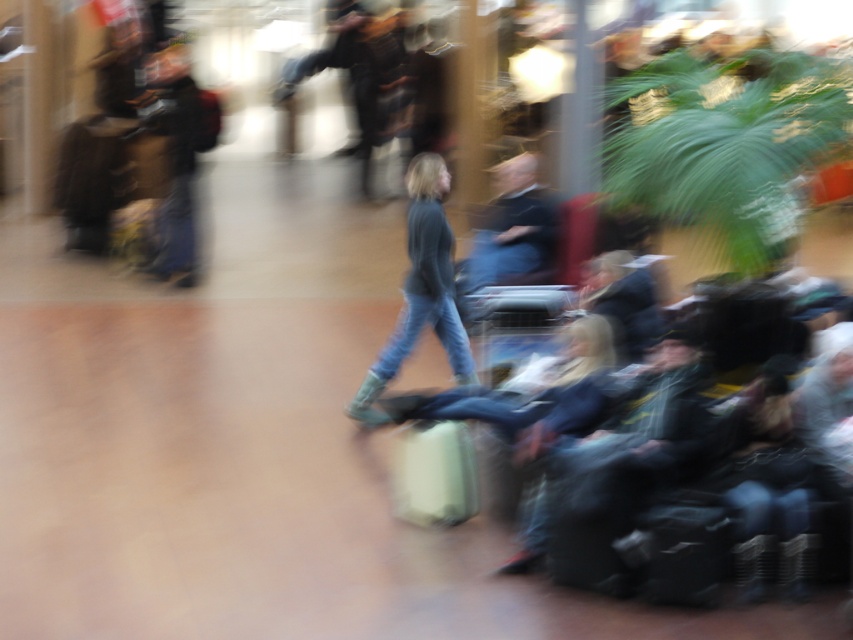
Can you confirm if denim jeans at center is positioned above dark blue sweater at center?

Actually, denim jeans at center is below dark blue sweater at center.

Does point (463, 326) lie in front of point (540, 198)?

Yes.

You are a GUI agent. You are given a task and a screenshot of the screen. Output one action in this format:
    pyautogui.click(x=<x>, y=<y>)
    Task: Click on the denim jeans at center
    The image size is (853, 640).
    Given the screenshot: What is the action you would take?
    pyautogui.click(x=421, y=291)

Does denim jeans at center have a larger size compared to black matte suitcase at lower right?

Yes.

Which is more to the right, denim jeans at center or black matte suitcase at lower right?

black matte suitcase at lower right

This screenshot has height=640, width=853. I want to click on denim jeans at center, so click(x=421, y=291).

Find the location of a particular element. The height and width of the screenshot is (640, 853). denim jeans at center is located at coordinates (421, 291).

Between denim jeans at center and beige fabric suitcase at center, which one is positioned higher?

denim jeans at center is above.

Does denim jeans at center appear under beige fabric suitcase at center?

No.

Measure the distance between point (x=434, y=172) and camera.

A distance of 7.45 meters exists between point (x=434, y=172) and camera.

Find the location of a particular element. The height and width of the screenshot is (640, 853). denim jeans at center is located at coordinates tap(421, 291).